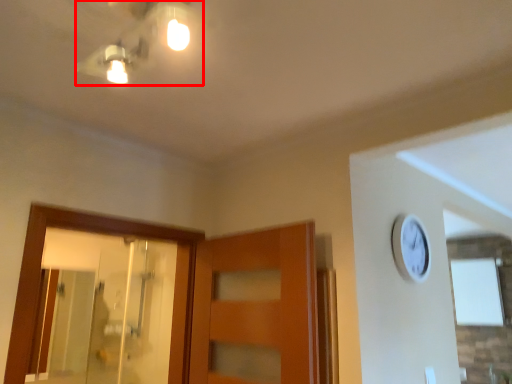
Question: Where is light fixture (annotated by the red box) located in relation to mirror in the image?

Choices:
 (A) right
 (B) left

Answer: (A)